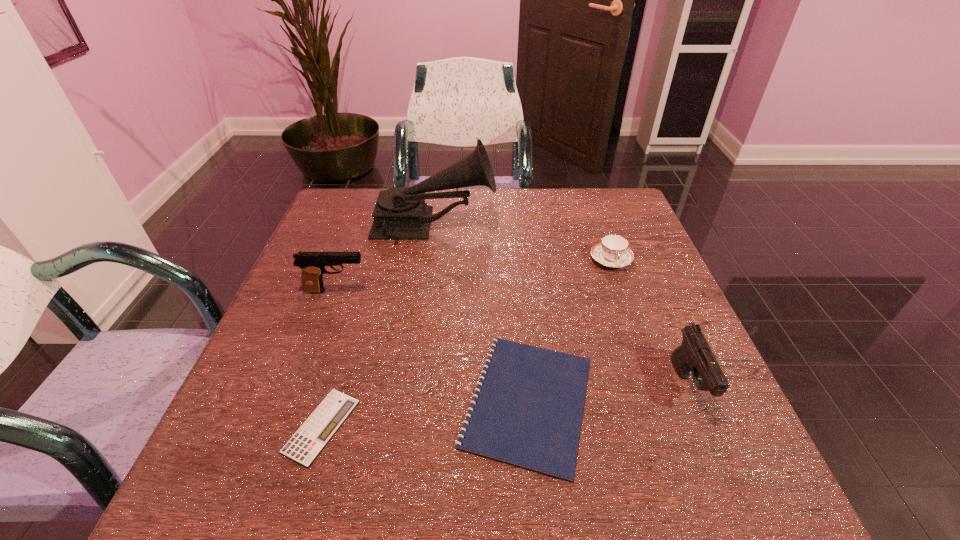
Locate an element on the screen. pistol that is positioned at the right edge is located at coordinates (694, 354).

You are a GUI agent. You are given a task and a screenshot of the screen. Output one action in this format:
    pyautogui.click(x=<x>, y=<y>)
    Task: Click on the teacup situated at the right edge
    Image resolution: width=960 pixels, height=540 pixels.
    Given the screenshot: What is the action you would take?
    pyautogui.click(x=612, y=251)

Locate an element on the screen. The image size is (960, 540). object located in the far left corner section of the desktop is located at coordinates (400, 213).

Identify the location of object located at the near left corner. (310, 439).

In order to click on blank space at the far edge of the desktop in this screenshot , I will do `click(579, 221)`.

Locate an element on the screen. The height and width of the screenshot is (540, 960). free space at the near edge of the desktop is located at coordinates (451, 508).

In the image, there is a desktop. Where is `blank space at the left edge`? This screenshot has height=540, width=960. blank space at the left edge is located at coordinates (357, 244).

In the image, there is a desktop. Where is `vacant space at the right edge`? vacant space at the right edge is located at coordinates [x=673, y=326].

The height and width of the screenshot is (540, 960). In order to click on vacant point at the far left corner in this screenshot , I will do `click(354, 204)`.

This screenshot has width=960, height=540. Find the location of `empty location between the calculator and the tallest object`. empty location between the calculator and the tallest object is located at coordinates (377, 326).